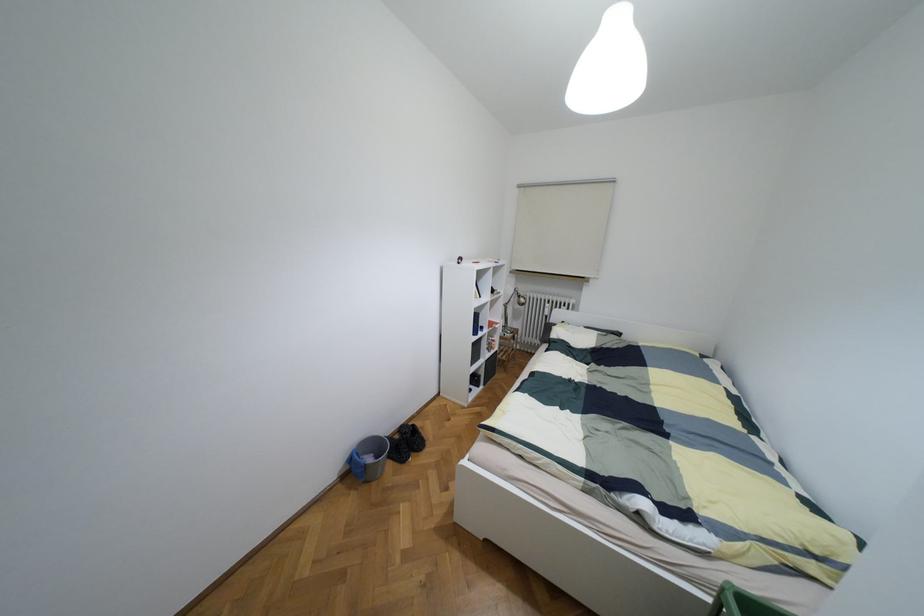
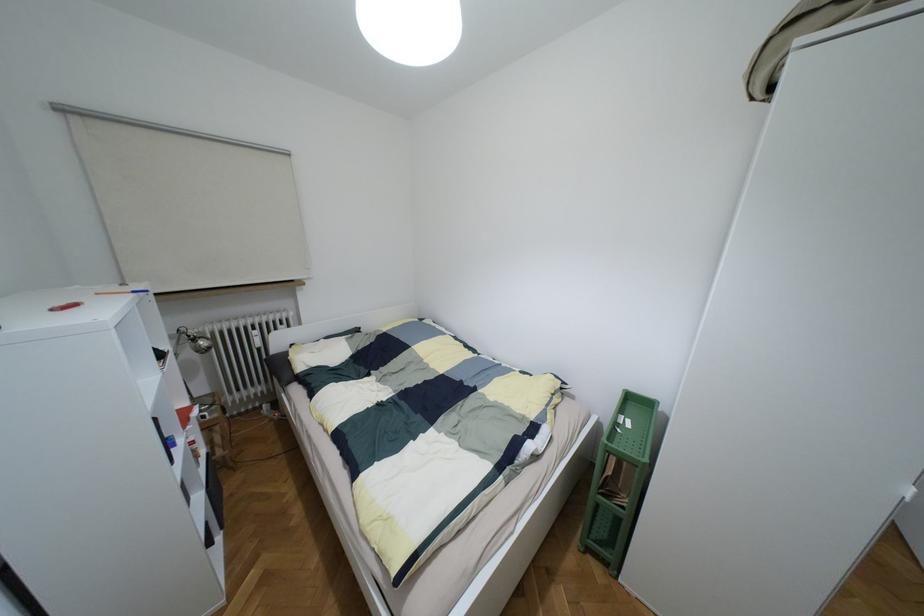
Question: How did the camera likely rotate?

Choices:
 (A) Left
 (B) Right
 (C) Up
 (D) Down

Answer: (B)